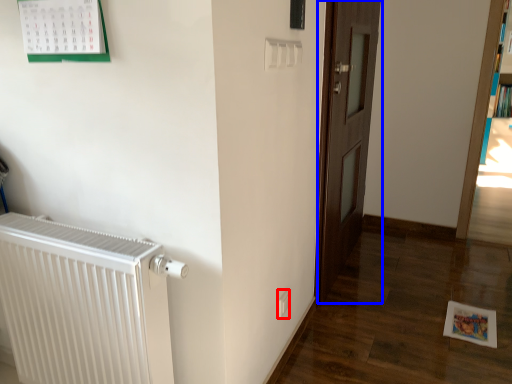
Question: Which point is further to the camera, electric outlet (highlighted by a red box) or door (highlighted by a blue box)?

Choices:
 (A) electric outlet
 (B) door

Answer: (B)